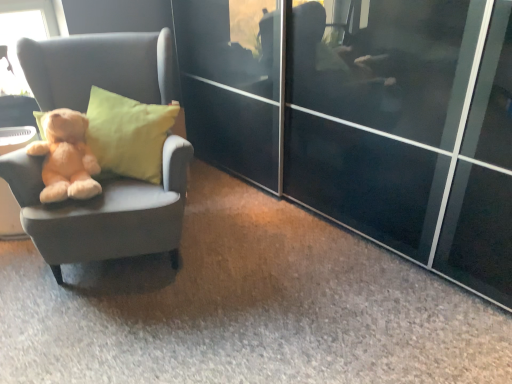
Question: Is matte gray chair at left in front of or behind soft plush teddy bear at left in the image?

Choices:
 (A) behind
 (B) front

Answer: (B)

Question: Is point (161, 198) positioned closer to the camera than point (79, 130)?

Choices:
 (A) closer
 (B) farther

Answer: (A)

Question: From the image's perspective, relative to soft plush teddy bear at left, is matte gray chair at left above or below?

Choices:
 (A) above
 (B) below

Answer: (A)

Question: Considering the positions of point (73, 196) and point (119, 190), is point (73, 196) closer or farther from the camera than point (119, 190)?

Choices:
 (A) closer
 (B) farther

Answer: (A)

Question: From the image's perspective, is soft plush teddy bear at left located above or below matte gray chair at left?

Choices:
 (A) below
 (B) above

Answer: (A)

Question: From a real-world perspective, is soft plush teddy bear at left physically located above or below matte gray chair at left?

Choices:
 (A) below
 (B) above

Answer: (B)

Question: Relative to matte gray chair at left, is soft plush teddy bear at left in front or behind?

Choices:
 (A) behind
 (B) front

Answer: (A)